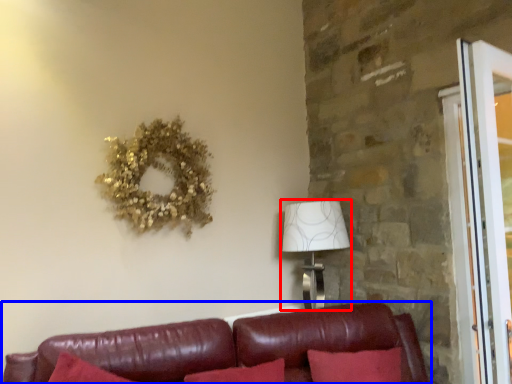
Question: Which of the following is the farthest to the observer, table lamp (highlighted by a red box) or studio couch (highlighted by a blue box)?

Choices:
 (A) table lamp
 (B) studio couch

Answer: (A)